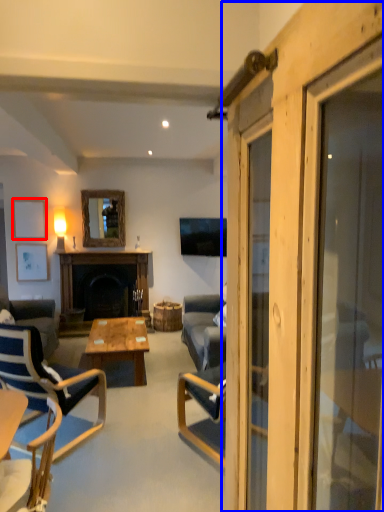
Question: Which point is closer to the camera, picture frame (highlighted by a red box) or barn door (highlighted by a blue box)?

Choices:
 (A) picture frame
 (B) barn door

Answer: (B)